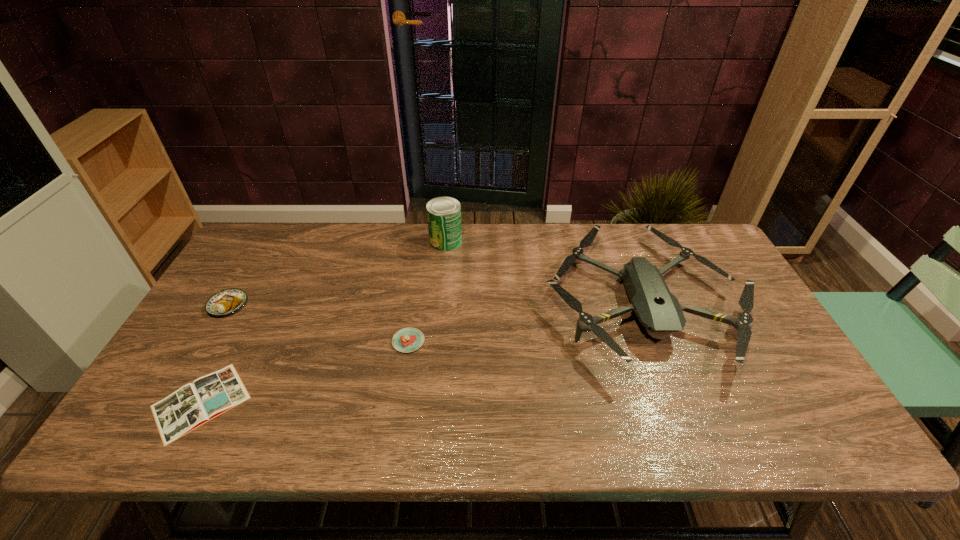
This screenshot has height=540, width=960. In order to click on can in this screenshot , I will do `click(443, 213)`.

The height and width of the screenshot is (540, 960). I want to click on the fourth shortest object, so click(658, 310).

Locate an element on the screen. The image size is (960, 540). drone is located at coordinates (658, 310).

Find the location of a particular element. The width and height of the screenshot is (960, 540). the left pastry is located at coordinates (225, 302).

You are a GUI agent. You are given a task and a screenshot of the screen. Output one action in this format:
    pyautogui.click(x=<x>, y=<y>)
    Task: Click on the farther pastry
    This screenshot has width=960, height=540.
    Given the screenshot: What is the action you would take?
    pyautogui.click(x=225, y=302)

Locate an element on the screen. the second shortest object is located at coordinates (406, 340).

Identify the location of the shorter pastry. (406, 340).

The height and width of the screenshot is (540, 960). I want to click on book, so click(x=192, y=405).

Find the location of a particular element. blank space located on the right of the can is located at coordinates (577, 241).

At what (x,y) coordinates should I click in order to perform the action: click on free spot located with a camera mounted on the front of the second tallest object. Please return your answer as a coordinate pair (x, y). The width and height of the screenshot is (960, 540). Looking at the image, I should click on (690, 423).